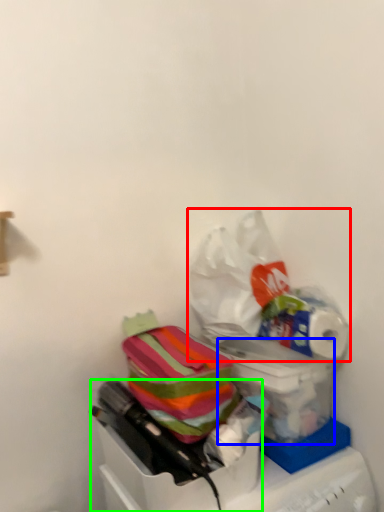
Question: Estimate the real-world distances between objects in this image. Which object is closer to plastic bag (highlighted by a red box), box (highlighted by a blue box) or box (highlighted by a green box)?

Choices:
 (A) box
 (B) box

Answer: (A)